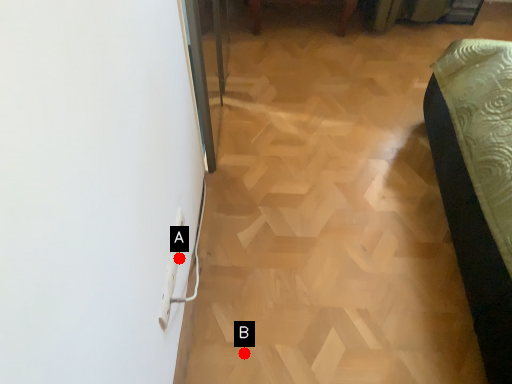
Question: Two points are circled on the image, labeled by A and B beside each circle. Which point is farther to the camera?

Choices:
 (A) A is further
 (B) B is further

Answer: (B)